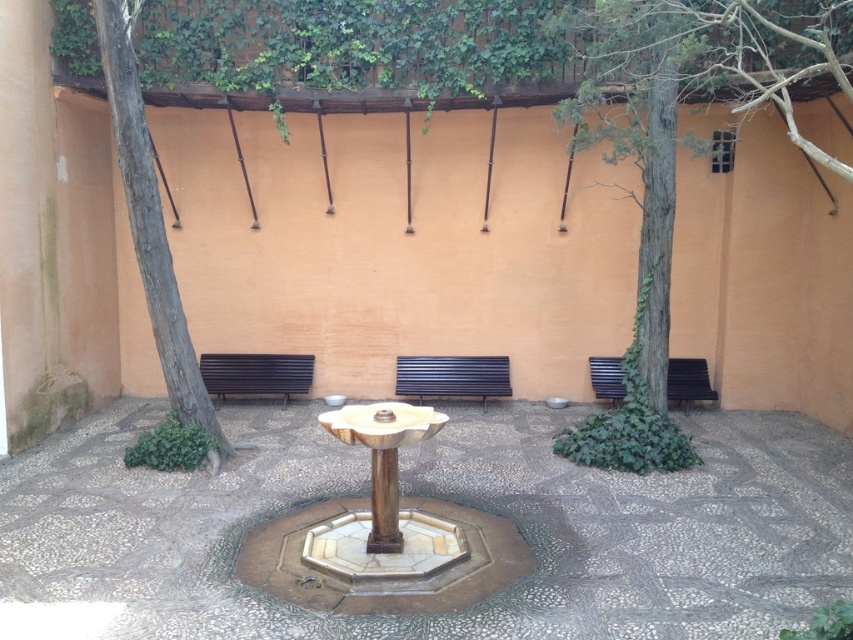
Question: Does brown wooden bench at center have a smaller size compared to black wood bench at left?

Choices:
 (A) yes
 (B) no

Answer: (B)

Question: Which object appears farthest from the camera in this image?

Choices:
 (A) green leafy tree at left
 (B) brown wooden bench at center

Answer: (B)

Question: Which point is farther from the camera taking this photo?

Choices:
 (A) (596, 380)
 (B) (111, 38)
 (C) (303, 381)

Answer: (C)

Question: Which of the following is the farthest from the observer?

Choices:
 (A) brown wooden bench at center
 (B) wooden park bench at right
 (C) green leafy tree at left
 (D) black wood bench at left

Answer: (D)

Question: Does brown wooden bench at center have a larger size compared to black wood bench at left?

Choices:
 (A) no
 (B) yes

Answer: (B)

Question: Can you confirm if brown wooden bench at center is positioned to the right of wooden park bench at right?

Choices:
 (A) no
 (B) yes

Answer: (A)